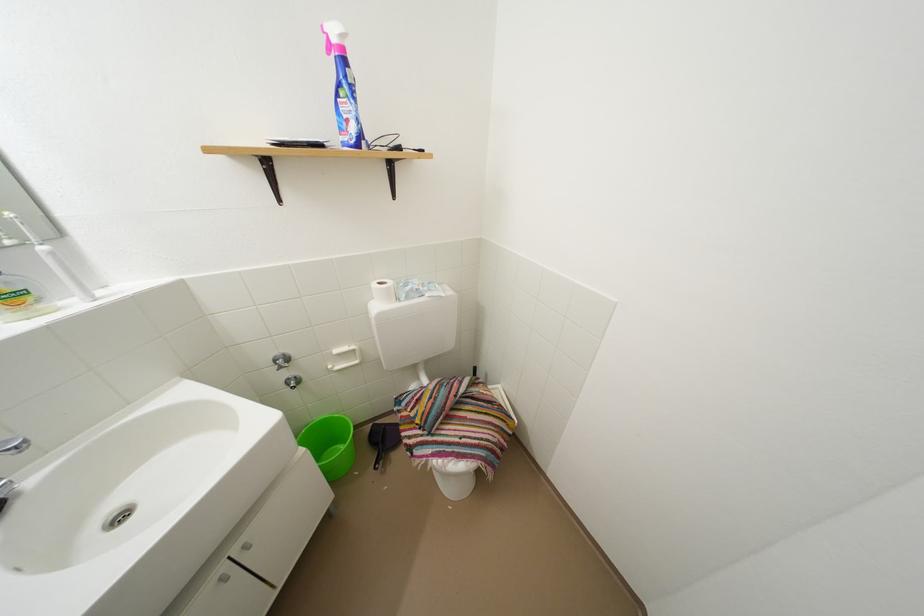
Where would you pull the toilet paper holder? Please return your answer as a coordinate pair (x, y).

(383, 291)